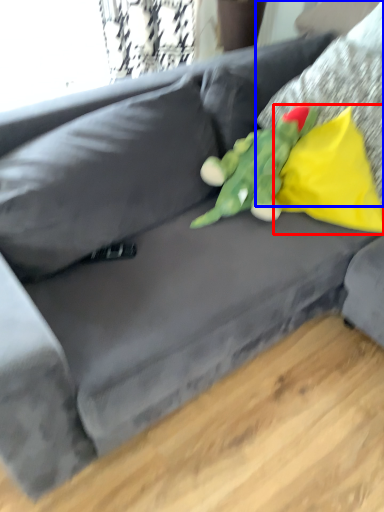
Question: Which point is further to the camera, pillow (highlighted by a red box) or pillow (highlighted by a blue box)?

Choices:
 (A) pillow
 (B) pillow

Answer: (A)